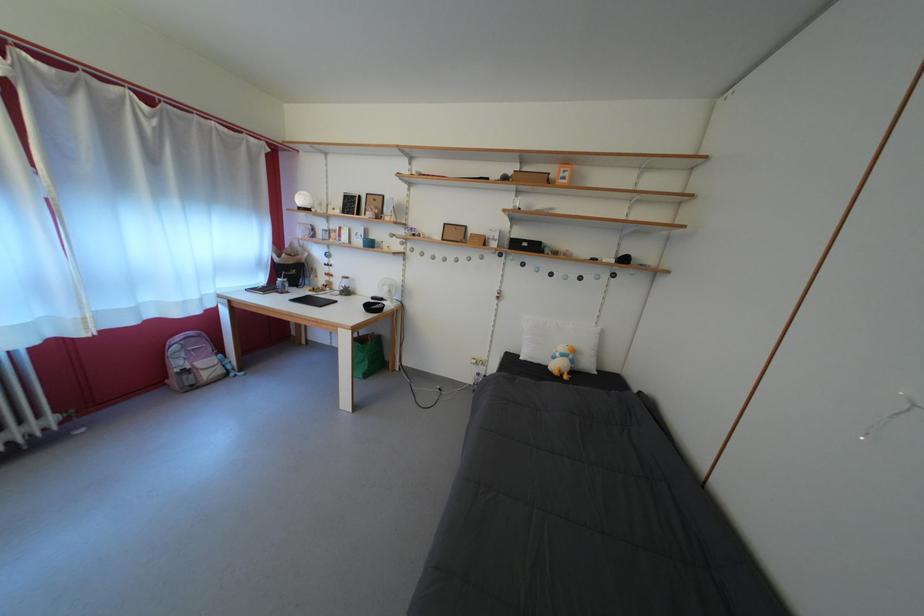
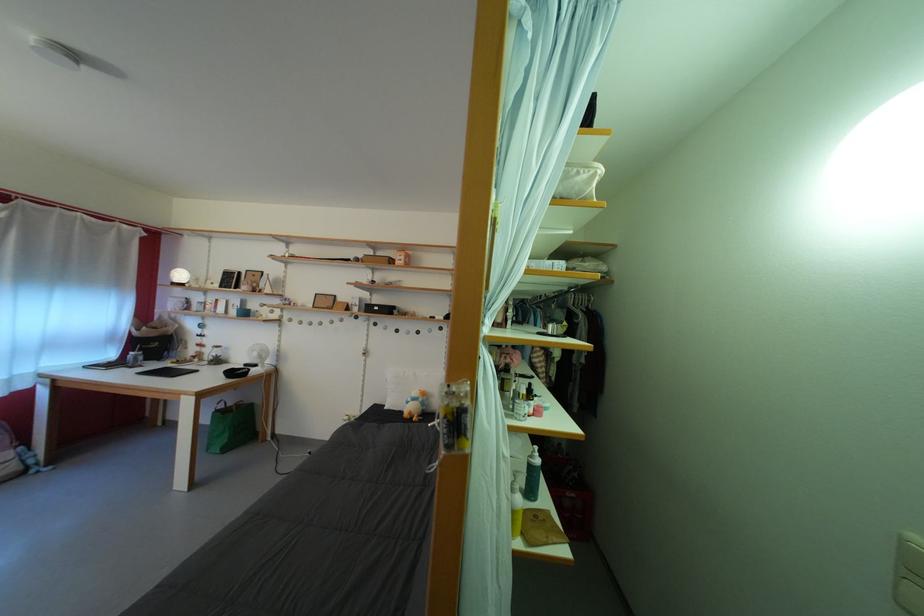
Question: How did the camera likely rotate?

Choices:
 (A) Left
 (B) Right
 (C) Up
 (D) Down

Answer: (C)